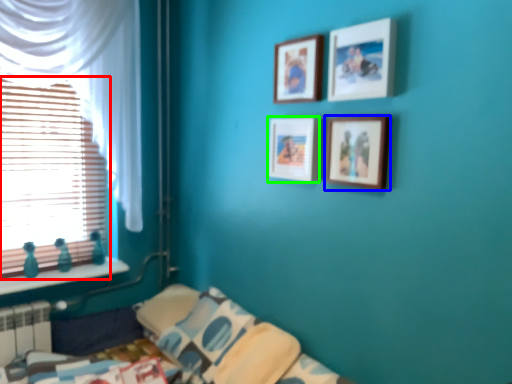
Question: Considering the real-world distances, which object is closest to window (highlighted by a red box)? picture frame (highlighted by a blue box) or picture frame (highlighted by a green box).

Choices:
 (A) picture frame
 (B) picture frame

Answer: (B)